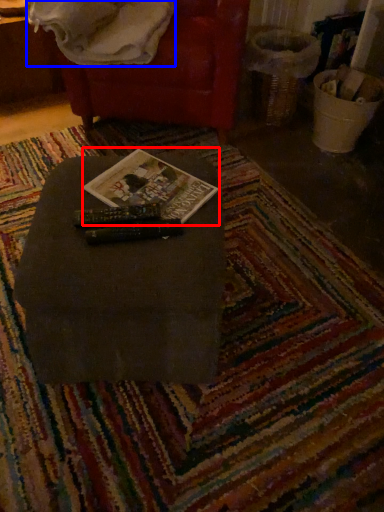
Question: Which object appears farthest to the camera in this image, paperback book (highlighted by a red box) or blanket (highlighted by a blue box)?

Choices:
 (A) paperback book
 (B) blanket

Answer: (B)